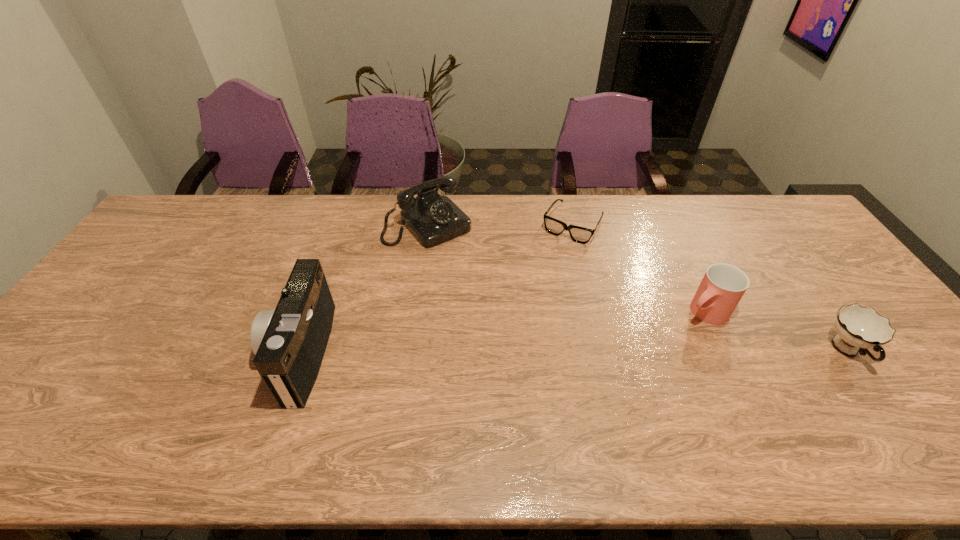
Where is `vacant space located 0.310m on the side of the left cup with the handle`? vacant space located 0.310m on the side of the left cup with the handle is located at coordinates (610, 379).

Image resolution: width=960 pixels, height=540 pixels. What are the coordinates of `free space located on the side of the left cup with the handle` in the screenshot? It's located at (637, 359).

This screenshot has height=540, width=960. Find the location of `telephone present at the far edge`. telephone present at the far edge is located at coordinates (433, 219).

The width and height of the screenshot is (960, 540). I want to click on sunglasses situated at the far edge, so click(x=578, y=234).

In order to click on object that is at the near edge in this screenshot , I will do `click(289, 342)`.

Locate an element on the screen. object positioned at the right edge is located at coordinates (859, 328).

In the image, there is a desktop. Where is `vacant space at the far edge`? vacant space at the far edge is located at coordinates 632,208.

This screenshot has width=960, height=540. Identify the location of free space at the left edge of the desktop. (124, 291).

Find the location of a particular element. vacant space at the far right corner of the desktop is located at coordinates (795, 214).

The image size is (960, 540). What are the coordinates of `vacant space at the near right corner of the desktop` in the screenshot? It's located at (884, 382).